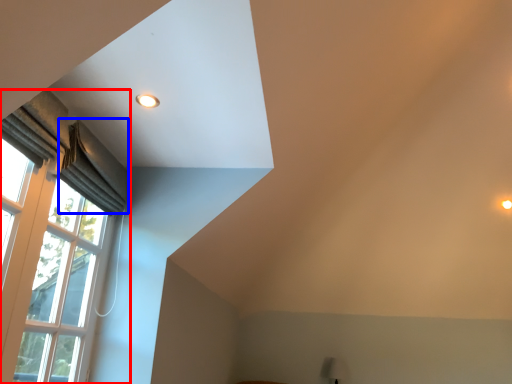
Question: Which point is further to the camera, window (highlighted by a red box) or curtain (highlighted by a blue box)?

Choices:
 (A) window
 (B) curtain

Answer: (B)